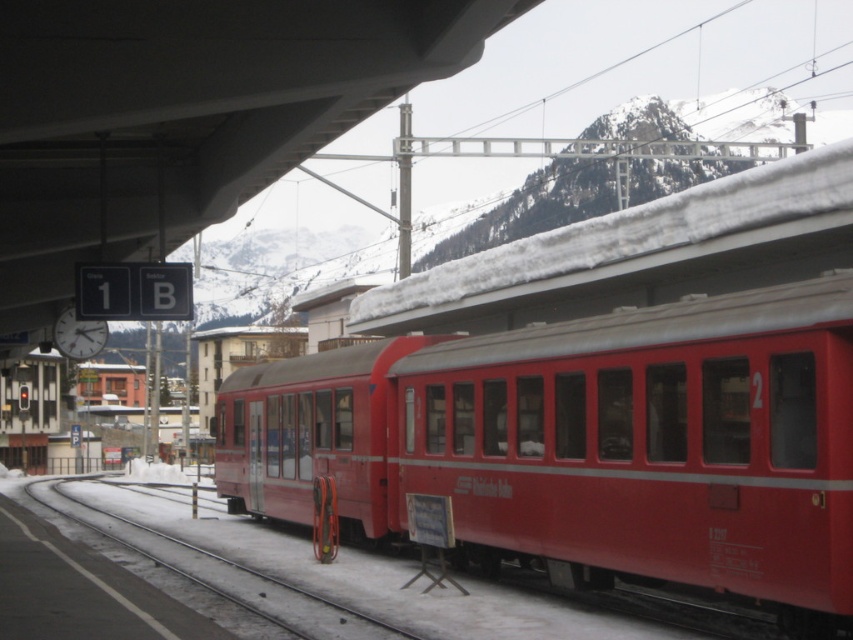
Is the position of matte red train at center less distant than that of metallic red track at lower center?

Yes, it is.

Which of these two, matte red train at center or metallic red track at lower center, stands taller?

With more height is matte red train at center.

Locate an element on the screen. Image resolution: width=853 pixels, height=640 pixels. matte red train at center is located at coordinates (585, 444).